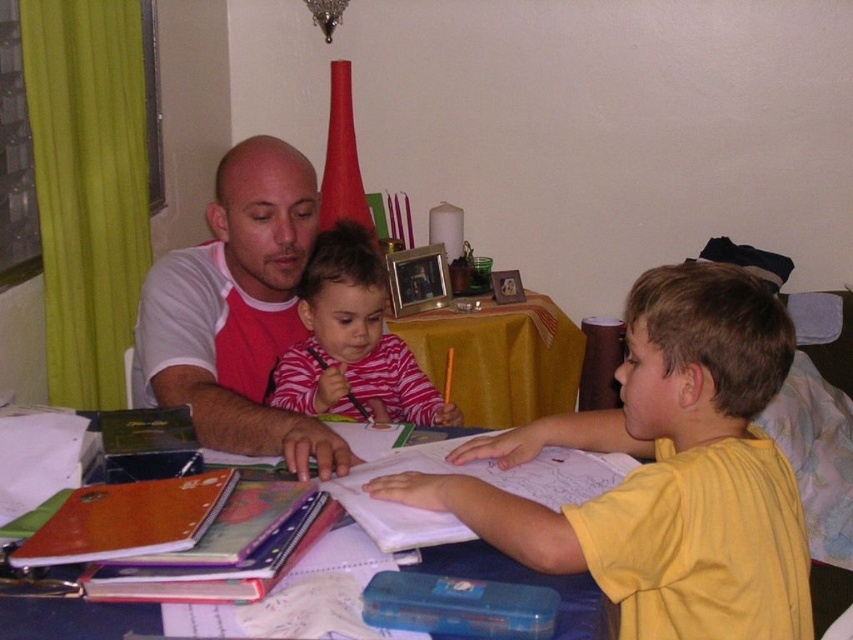
Question: Does yellow fabric table at center come behind blue plastic table at center?

Choices:
 (A) yes
 (B) no

Answer: (A)

Question: Estimate the real-world distances between objects in this image. Which object is closer to the yellow matte shirt at center?

Choices:
 (A) yellow fabric table at center
 (B) white/red raglan shirt at center
 (C) striped cotton shirt at center
 (D) blue plastic table at center

Answer: (D)

Question: Is yellow matte shirt at center bigger than blue plastic table at center?

Choices:
 (A) yes
 (B) no

Answer: (A)

Question: Considering the real-world distances, which object is closest to the yellow matte shirt at center?

Choices:
 (A) striped cotton shirt at center
 (B) blue plastic table at center

Answer: (B)

Question: Which of the following is the farthest from the observer?

Choices:
 (A) (328, 307)
 (B) (119, 632)
 (C) (271, 259)

Answer: (A)

Question: Can you confirm if yellow matte shirt at center is positioned to the left of white/red raglan shirt at center?

Choices:
 (A) no
 (B) yes

Answer: (A)